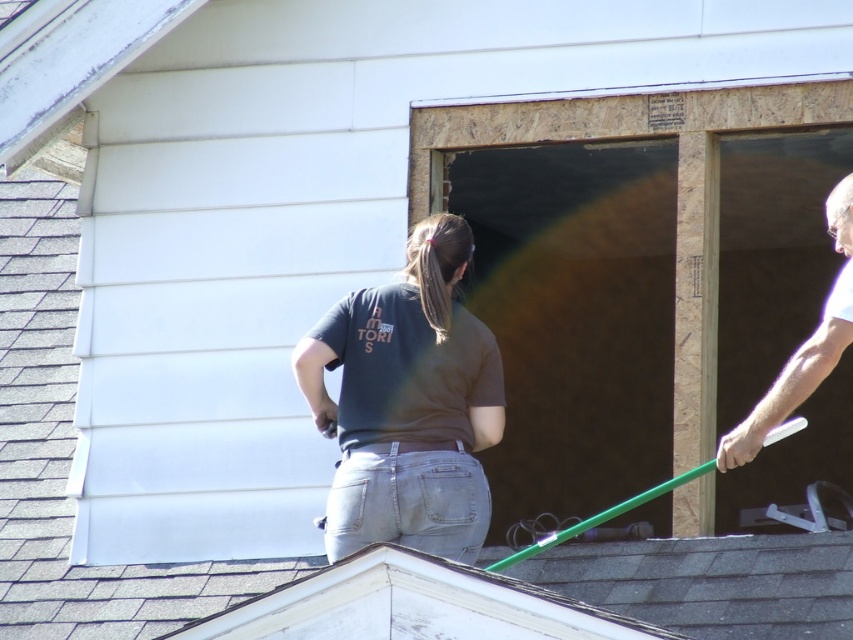
Does point (358, 413) come in front of point (828, 317)?

No.

The image size is (853, 640). Find the location of `dark gray t-shirt at center`. dark gray t-shirt at center is located at coordinates (408, 404).